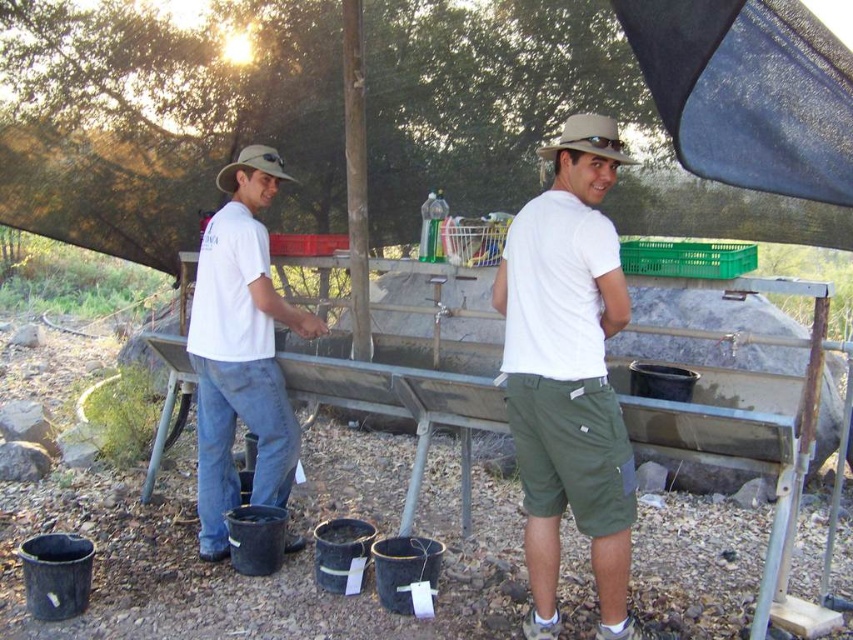
Does white cotton shirt at center appear on the left side of denim jeans at left?

Incorrect, white cotton shirt at center is not on the left side of denim jeans at left.

The width and height of the screenshot is (853, 640). What do you see at coordinates (569, 372) in the screenshot?
I see `white cotton shirt at center` at bounding box center [569, 372].

Image resolution: width=853 pixels, height=640 pixels. I want to click on white cotton shirt at center, so click(569, 372).